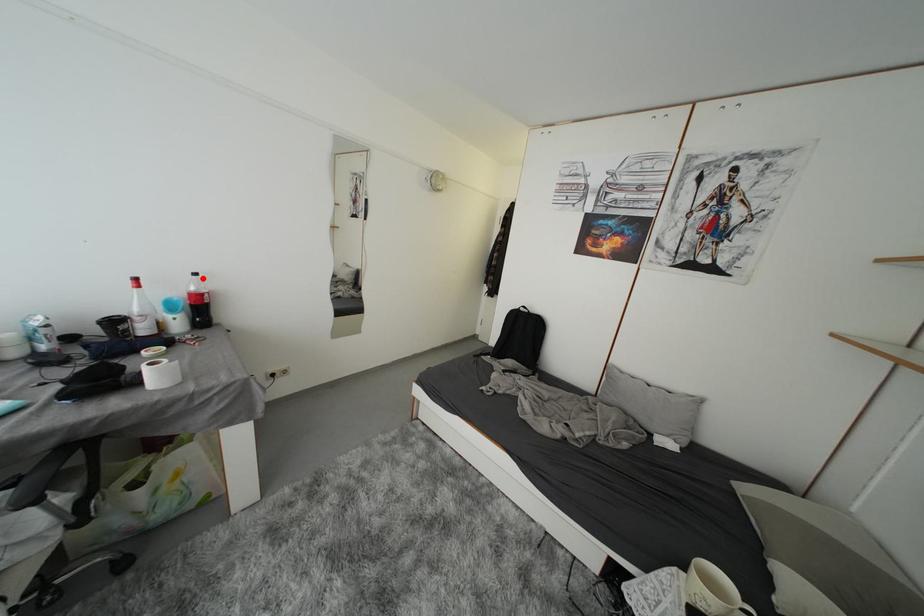
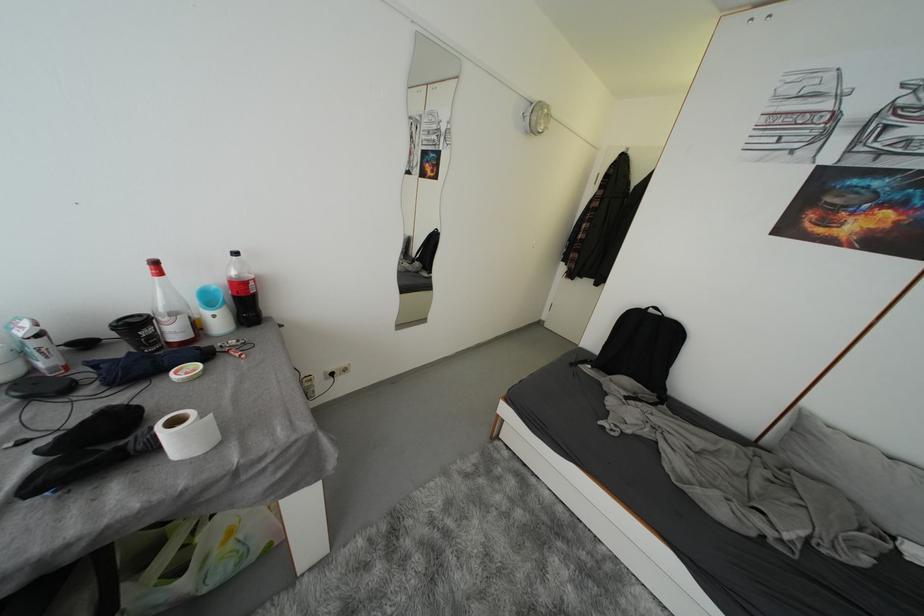
In the second image, find the point that corresponds to the highlighted location in the first image.

(242, 257)